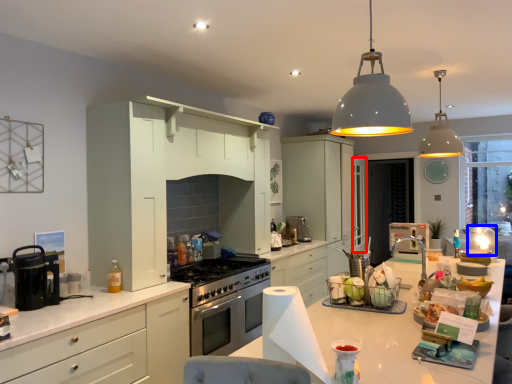
Question: Which of the following is the farthest to the observer, glass door (highlighted by a red box) or appliance (highlighted by a blue box)?

Choices:
 (A) glass door
 (B) appliance

Answer: (A)